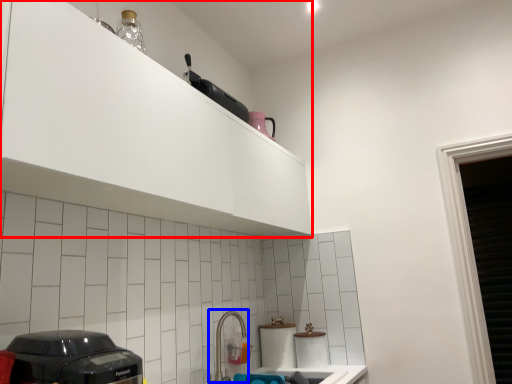
Question: Which of the following is the closest to the observer, cabinetry (highlighted by a red box) or faucet (highlighted by a blue box)?

Choices:
 (A) cabinetry
 (B) faucet

Answer: (A)